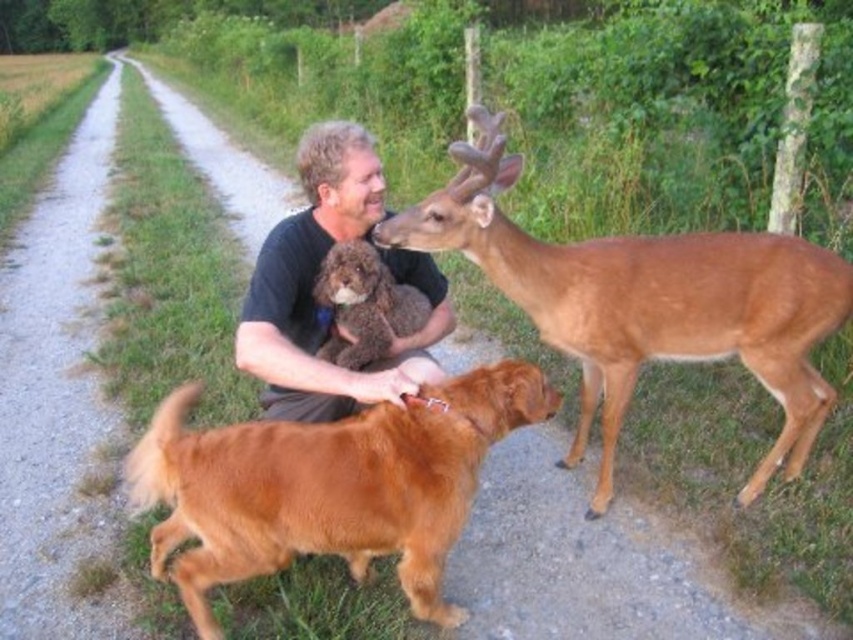
You are a photographer trying to capture a photo of the golden fur dog at center and the brown plush toy at center. From the photographer perspective, which object is located to the right?

The brown plush toy at center is located to the right of the golden fur dog at center.